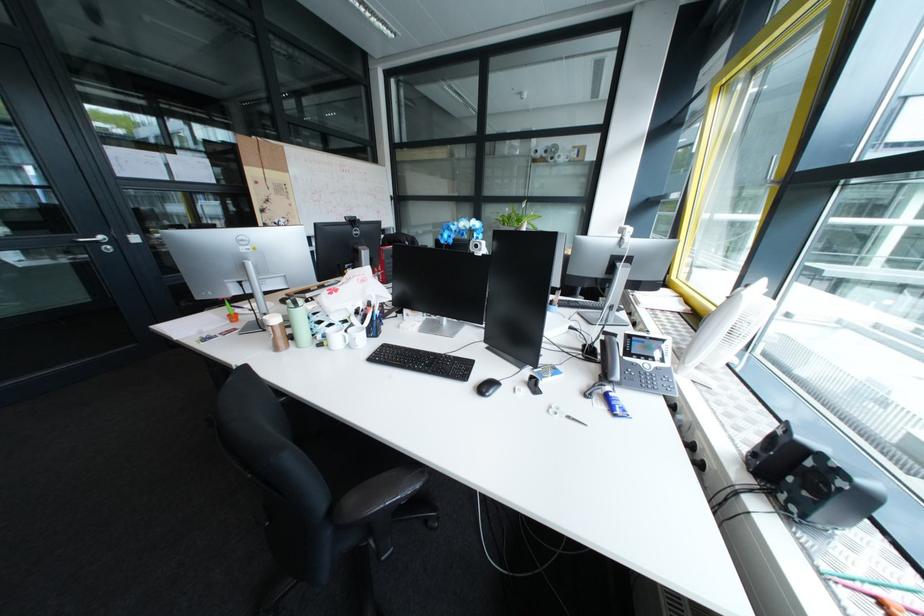
Locate an element on the screen. The height and width of the screenshot is (616, 924). silver door handle is located at coordinates (98, 241).